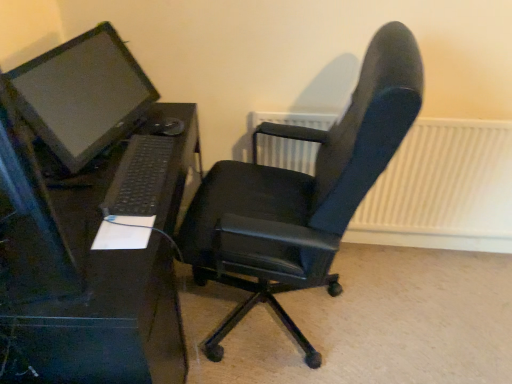
Where is `free point above black plastic keyboard at lower left (from a real-world perspective)`? free point above black plastic keyboard at lower left (from a real-world perspective) is located at coordinates (134, 165).